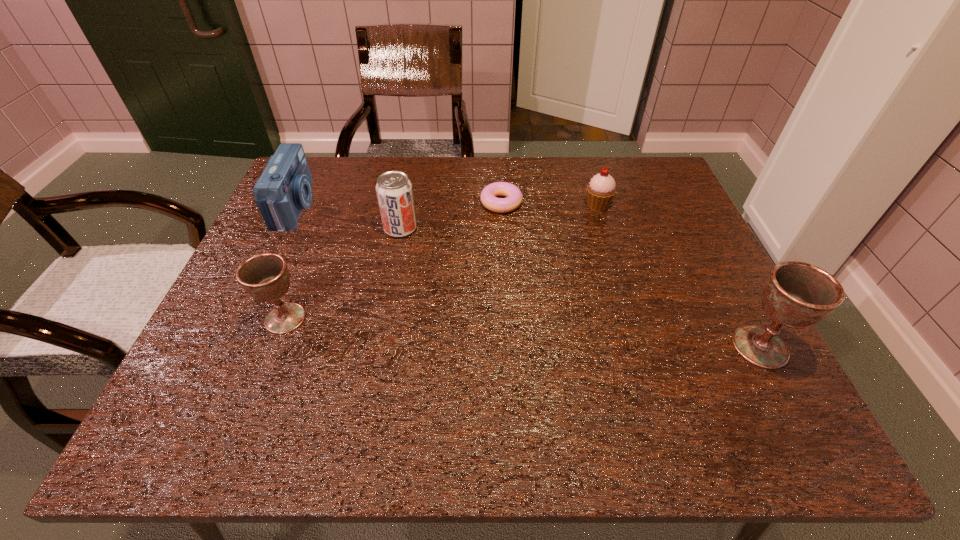
The width and height of the screenshot is (960, 540). In order to click on location for an additional chalice to make spacing equal in this screenshot , I will do `click(516, 332)`.